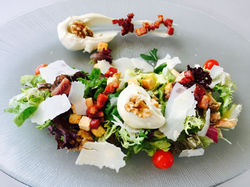
Image resolution: width=250 pixels, height=187 pixels. I want to click on glass plate, so click(184, 54).